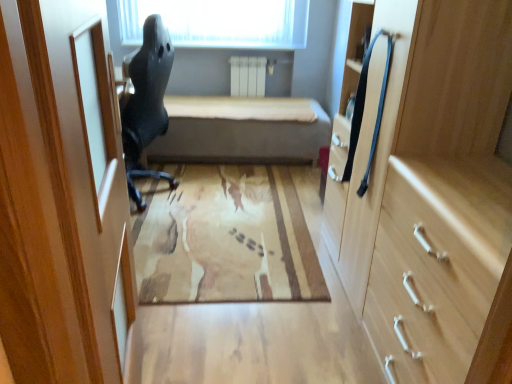
Question: From a real-world perspective, is matte black chair at left located beneath light wood drawer at right?

Choices:
 (A) no
 (B) yes

Answer: (A)

Question: Can you confirm if matte black chair at left is bigger than light wood drawer at right?

Choices:
 (A) no
 (B) yes

Answer: (B)

Question: Is matte black chair at left oriented towards light wood drawer at right?

Choices:
 (A) yes
 (B) no

Answer: (B)

Question: Can you confirm if matte black chair at left is wider than light wood drawer at right?

Choices:
 (A) no
 (B) yes

Answer: (B)

Question: Is matte black chair at left taller than light wood drawer at right?

Choices:
 (A) yes
 (B) no

Answer: (A)

Question: Considering the positions of point (381, 322) and point (209, 107), is point (381, 322) closer or farther from the camera than point (209, 107)?

Choices:
 (A) closer
 (B) farther

Answer: (A)

Question: From the image's perspective, relative to beige fabric bed at center, is light wood cabinet at right above or below?

Choices:
 (A) below
 (B) above

Answer: (A)

Question: Relative to beige fabric bed at center, is light wood cabinet at right in front or behind?

Choices:
 (A) behind
 (B) front

Answer: (B)

Question: Considering the positions of light wood cabinet at right and beige fabric bed at center in the image, is light wood cabinet at right bigger or smaller than beige fabric bed at center?

Choices:
 (A) big
 (B) small

Answer: (B)

Question: Would you say beige fabric bed at center is to the left or to the right of matte black chair at left in the picture?

Choices:
 (A) right
 (B) left

Answer: (A)

Question: From their relative heights in the image, would you say beige fabric bed at center is taller or shorter than matte black chair at left?

Choices:
 (A) tall
 (B) short

Answer: (B)

Question: From a real-world perspective, is beige fabric bed at center positioned above or below matte black chair at left?

Choices:
 (A) above
 (B) below

Answer: (B)

Question: Is beige fabric bed at center inside the boundaries of matte black chair at left, or outside?

Choices:
 (A) inside
 (B) outside

Answer: (B)

Question: Based on their sizes in the image, would you say beige fabric bed at center is bigger or smaller than light wood cabinet at right?

Choices:
 (A) big
 (B) small

Answer: (A)

Question: Considering the positions of point (246, 97) and point (373, 74), is point (246, 97) closer or farther from the camera than point (373, 74)?

Choices:
 (A) farther
 (B) closer

Answer: (A)